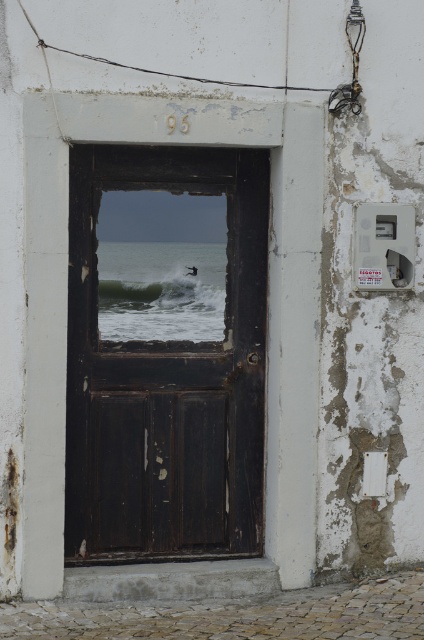
Between point (234, 538) and point (161, 284), which one is positioned in front?

Point (161, 284) is more forward.

Is point (194, 385) in front of point (106, 298)?

That is False.

What do you see at coordinates (167, 378) in the screenshot? I see `dark wood door at center` at bounding box center [167, 378].

You are a GUI agent. You are given a task and a screenshot of the screen. Output one action in this format:
    pyautogui.click(x=<x>, y=<y>)
    Task: Click on the dark wood door at center
    
    Given the screenshot: What is the action you would take?
    coord(167,378)